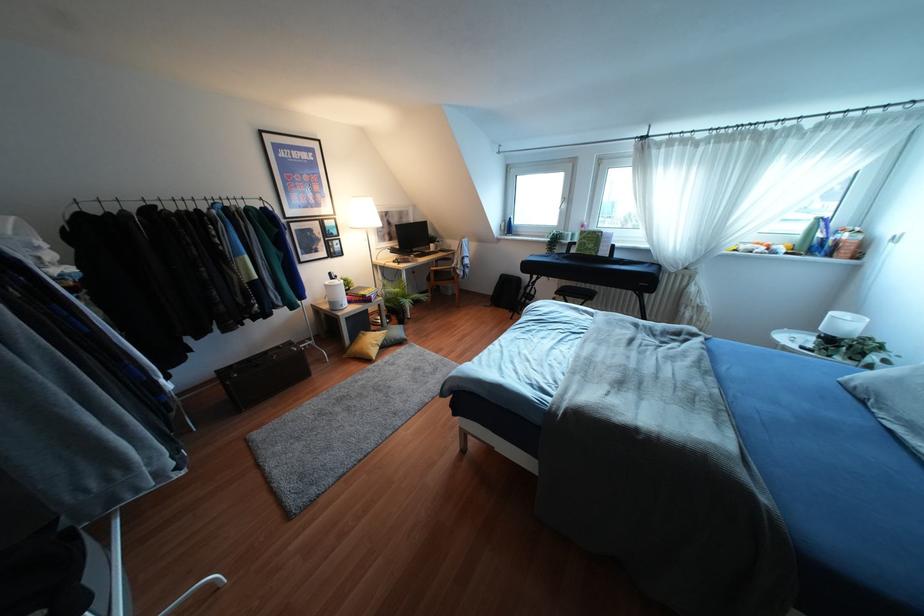
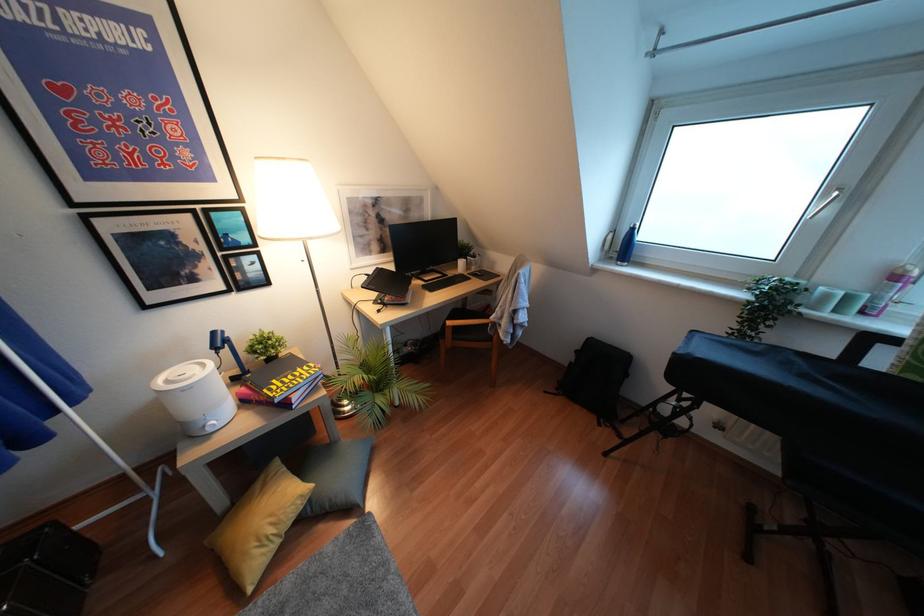
Find the pixel in the second image that matches point (507, 227) in the first image.

(623, 246)